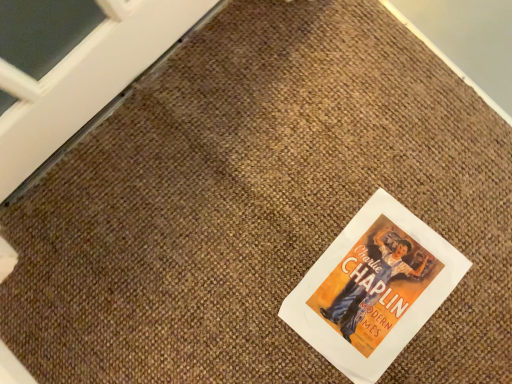
What do you see at coordinates (373, 288) in the screenshot?
I see `orange paper poster at center` at bounding box center [373, 288].

The width and height of the screenshot is (512, 384). I want to click on orange paper poster at center, so click(373, 288).

Find the location of `orange paper poster at center`. orange paper poster at center is located at coordinates (373, 288).